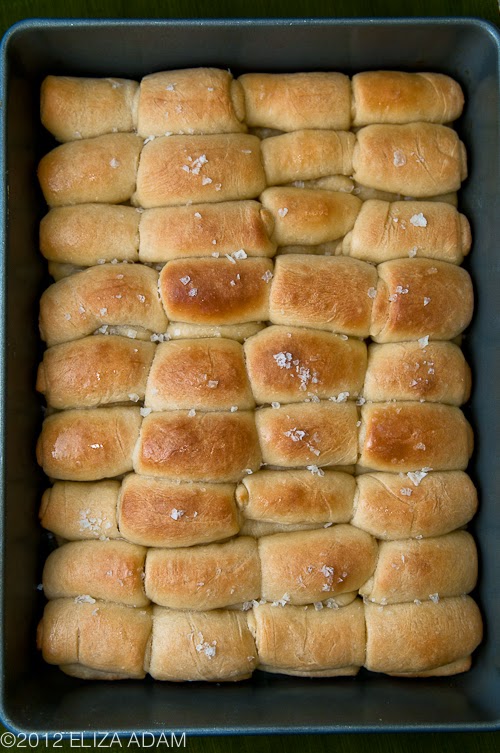
The width and height of the screenshot is (500, 753). I want to click on table, so point(292,747).